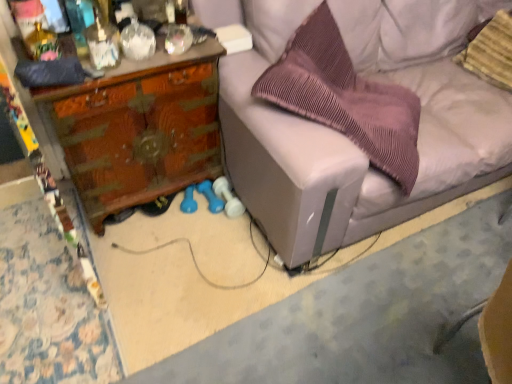
The image size is (512, 384). In order to click on purple pleated pillow at center, which is the 2th pillow in right-to-left order in this screenshot , I will do `click(344, 98)`.

The height and width of the screenshot is (384, 512). What are the coordinates of `light gray fabric couch at center` in the screenshot? It's located at (346, 137).

What is the approximate width of wooden desk at left?

wooden desk at left is 16.31 inches in width.

Find the location of a particular element. The image size is (512, 384). striped fabric pillow at upper right, acting as the second pillow starting from the left is located at coordinates (490, 51).

Is light gray fabric couch at center bigger than striped fabric pillow at upper right, the 1th pillow when ordered from right to left?

Yes, light gray fabric couch at center is bigger than striped fabric pillow at upper right, the 1th pillow when ordered from right to left.

Would you say light gray fabric couch at center is a long distance from striped fabric pillow at upper right, acting as the second pillow starting from the left?

No, light gray fabric couch at center is not far away from striped fabric pillow at upper right, acting as the second pillow starting from the left.

Is light gray fabric couch at center facing towards striped fabric pillow at upper right, the 1th pillow when ordered from right to left?

Yes.

From a real-world perspective, is light gray fabric couch at center below striped fabric pillow at upper right, acting as the second pillow starting from the left?

Yes, from a real-world perspective, light gray fabric couch at center is under striped fabric pillow at upper right, acting as the second pillow starting from the left.

Does wooden desk at left have a larger size compared to purple pleated pillow at center, placed as the first pillow when sorted from left to right?

No, wooden desk at left is not bigger than purple pleated pillow at center, placed as the first pillow when sorted from left to right.

Based on the photo, are wooden desk at left and purple pleated pillow at center, placed as the first pillow when sorted from left to right, making contact?

No, wooden desk at left is not touching purple pleated pillow at center, placed as the first pillow when sorted from left to right.

Considering the relative sizes of wooden desk at left and purple pleated pillow at center, which is the 2th pillow in right-to-left order, in the image provided, is wooden desk at left shorter than purple pleated pillow at center, which is the 2th pillow in right-to-left order,?

Indeed, wooden desk at left has a lesser height compared to purple pleated pillow at center, which is the 2th pillow in right-to-left order.

Is wooden desk at left at the left side of purple pleated pillow at center, which is the 2th pillow in right-to-left order?

Yes.

Is light gray fabric couch at center not near wooden desk at left?

They are positioned close to each other.

Considering the positions of objects light gray fabric couch at center and wooden desk at left in the image provided, who is behind, light gray fabric couch at center or wooden desk at left?

wooden desk at left is more distant.

Is wooden desk at left located within light gray fabric couch at center?

No, wooden desk at left is not surrounded by light gray fabric couch at center.

Is point (433, 88) closer to viewer compared to point (197, 53)?

That is False.

Is striped fabric pillow at upper right, acting as the second pillow starting from the left, in front of or behind wooden desk at left in the image?

In the image, striped fabric pillow at upper right, acting as the second pillow starting from the left, appears behind wooden desk at left.

Which is behind, point (503, 54) or point (213, 40)?

Point (503, 54)

Consider the image. Considering the sizes of objects striped fabric pillow at upper right, acting as the second pillow starting from the left, and wooden desk at left in the image provided, who is smaller, striped fabric pillow at upper right, acting as the second pillow starting from the left, or wooden desk at left?

Smaller between the two is striped fabric pillow at upper right, acting as the second pillow starting from the left.

Does striped fabric pillow at upper right, the 1th pillow when ordered from right to left, have a lesser width compared to wooden desk at left?

Indeed, striped fabric pillow at upper right, the 1th pillow when ordered from right to left, has a lesser width compared to wooden desk at left.

Does purple pleated pillow at center, which is the 2th pillow in right-to-left order, turn towards striped fabric pillow at upper right, the 1th pillow when ordered from right to left?

No, purple pleated pillow at center, which is the 2th pillow in right-to-left order, is not facing towards striped fabric pillow at upper right, the 1th pillow when ordered from right to left.

Does purple pleated pillow at center, which is the 2th pillow in right-to-left order, come in front of striped fabric pillow at upper right, acting as the second pillow starting from the left?

Yes, it is in front of striped fabric pillow at upper right, acting as the second pillow starting from the left.

Looking at their sizes, would you say purple pleated pillow at center, which is the 2th pillow in right-to-left order, is wider or thinner than striped fabric pillow at upper right, the 1th pillow when ordered from right to left?

In the image, purple pleated pillow at center, which is the 2th pillow in right-to-left order, appears to be wider than striped fabric pillow at upper right, the 1th pillow when ordered from right to left.

Which object is thinner, light gray fabric couch at center or purple pleated pillow at center, placed as the first pillow when sorted from left to right?

purple pleated pillow at center, placed as the first pillow when sorted from left to right, is thinner.

Between light gray fabric couch at center and purple pleated pillow at center, placed as the first pillow when sorted from left to right, which one has smaller size?

Smaller between the two is purple pleated pillow at center, placed as the first pillow when sorted from left to right.

Would you say light gray fabric couch at center is a long distance from purple pleated pillow at center, placed as the first pillow when sorted from left to right?

light gray fabric couch at center is actually quite close to purple pleated pillow at center, placed as the first pillow when sorted from left to right.

Based on the photo, which is in front, light gray fabric couch at center or purple pleated pillow at center, placed as the first pillow when sorted from left to right?

light gray fabric couch at center.

Considering the relative sizes of wooden desk at left and light gray fabric couch at center in the image provided, is wooden desk at left taller than light gray fabric couch at center?

Incorrect, the height of wooden desk at left is not larger of that of light gray fabric couch at center.

Is wooden desk at left directly adjacent to light gray fabric couch at center?

No, wooden desk at left is not making contact with light gray fabric couch at center.

Who is more distant, wooden desk at left or light gray fabric couch at center?

wooden desk at left is more distant.

You are a GUI agent. You are given a task and a screenshot of the screen. Output one action in this format:
    pyautogui.click(x=<x>, y=<y>)
    Task: Click on the studio couch below the striped fabric pillow at upper right, acting as the second pillow starting from the left (from a real-world perspective)
    The width and height of the screenshot is (512, 384).
    Given the screenshot: What is the action you would take?
    pyautogui.click(x=346, y=137)

Starting from the wooden desk at left, which pillow is the 1st one to the right? Please provide its 2D coordinates.

[(344, 98)]

Which object lies further to the anchor point purple pleated pillow at center, which is the 2th pillow in right-to-left order, light gray fabric couch at center or wooden desk at left?

The object further to purple pleated pillow at center, which is the 2th pillow in right-to-left order, is wooden desk at left.

Which object lies nearer to the anchor point light gray fabric couch at center, wooden desk at left or purple pleated pillow at center, placed as the first pillow when sorted from left to right?

purple pleated pillow at center, placed as the first pillow when sorted from left to right, lies closer to light gray fabric couch at center than the other object.

When comparing their distances from light gray fabric couch at center, does striped fabric pillow at upper right, acting as the second pillow starting from the left, or wooden desk at left seem further?

Among the two, wooden desk at left is located further to light gray fabric couch at center.

Considering their positions, is purple pleated pillow at center, placed as the first pillow when sorted from left to right, positioned further to wooden desk at left than light gray fabric couch at center?

Based on the image, purple pleated pillow at center, placed as the first pillow when sorted from left to right, appears to be further to wooden desk at left.

Considering their positions, is striped fabric pillow at upper right, acting as the second pillow starting from the left, positioned closer to wooden desk at left than light gray fabric couch at center?

The object closer to wooden desk at left is light gray fabric couch at center.

Based on the photo, from the image, which object appears to be farther from light gray fabric couch at center, wooden desk at left or striped fabric pillow at upper right, the 1th pillow when ordered from right to left?

wooden desk at left is positioned further to the anchor light gray fabric couch at center.

Looking at the image, which one is located further to purple pleated pillow at center, placed as the first pillow when sorted from left to right, wooden desk at left or striped fabric pillow at upper right, the 1th pillow when ordered from right to left?

Among the two, striped fabric pillow at upper right, the 1th pillow when ordered from right to left, is located further to purple pleated pillow at center, placed as the first pillow when sorted from left to right.

Which object lies nearer to the anchor point light gray fabric couch at center, purple pleated pillow at center, placed as the first pillow when sorted from left to right, or wooden desk at left?

Among the two, purple pleated pillow at center, placed as the first pillow when sorted from left to right, is located nearer to light gray fabric couch at center.

The height and width of the screenshot is (384, 512). I want to click on studio couch between wooden desk at left and striped fabric pillow at upper right, the 1th pillow when ordered from right to left, from left to right, so click(346, 137).

The height and width of the screenshot is (384, 512). I want to click on pillow positioned between light gray fabric couch at center and striped fabric pillow at upper right, acting as the second pillow starting from the left, from near to far, so click(344, 98).

At what (x,y) coordinates should I click in order to perform the action: click on pillow located between wooden desk at left and light gray fabric couch at center in the left-right direction. Please return your answer as a coordinate pair (x, y). The width and height of the screenshot is (512, 384). Looking at the image, I should click on (344, 98).

You are a GUI agent. You are given a task and a screenshot of the screen. Output one action in this format:
    pyautogui.click(x=<x>, y=<y>)
    Task: Click on the pillow situated between wooden desk at left and striped fabric pillow at upper right, acting as the second pillow starting from the left, from left to right
    This screenshot has width=512, height=384.
    Given the screenshot: What is the action you would take?
    pyautogui.click(x=344, y=98)